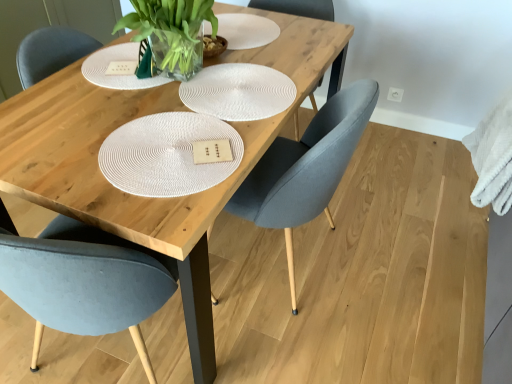
Question: Is matte gray chair at center, marked as the 2th chair in a right-to-left arrangement, aimed at matte gray chair at center, which is counted as the 1th chair, starting from the right?

Choices:
 (A) no
 (B) yes

Answer: (A)

Question: Does matte gray chair at center, marked as the 2th chair in a right-to-left arrangement, appear on the left side of matte gray chair at center, which is counted as the 1th chair, starting from the right?

Choices:
 (A) yes
 (B) no

Answer: (A)

Question: From a real-world perspective, is matte gray chair at center, marked as the 2th chair in a right-to-left arrangement, physically below matte gray chair at center, which appears as the 2th chair when viewed from the left?

Choices:
 (A) yes
 (B) no

Answer: (B)

Question: Can you confirm if matte gray chair at center, marked as the 2th chair in a right-to-left arrangement, is taller than matte gray chair at center, which appears as the 2th chair when viewed from the left?

Choices:
 (A) yes
 (B) no

Answer: (B)

Question: Are matte gray chair at center, marked as the 2th chair in a right-to-left arrangement, and matte gray chair at center, which appears as the 2th chair when viewed from the left, far apart?

Choices:
 (A) no
 (B) yes

Answer: (A)

Question: From the image's perspective, does matte gray chair at center, which ranks as the 1th chair in left-to-right order, appear lower than matte gray chair at center, which appears as the 2th chair when viewed from the left?

Choices:
 (A) yes
 (B) no

Answer: (A)

Question: Is matte gray chair at center, which ranks as the 1th chair in left-to-right order, placed right next to wooden table at center?

Choices:
 (A) yes
 (B) no

Answer: (B)

Question: Considering the relative sizes of matte gray chair at center, which ranks as the 1th chair in left-to-right order, and wooden table at center in the image provided, is matte gray chair at center, which ranks as the 1th chair in left-to-right order, thinner than wooden table at center?

Choices:
 (A) no
 (B) yes

Answer: (B)

Question: Considering the relative sizes of matte gray chair at center, which ranks as the 1th chair in left-to-right order, and wooden table at center in the image provided, is matte gray chair at center, which ranks as the 1th chair in left-to-right order, wider than wooden table at center?

Choices:
 (A) no
 (B) yes

Answer: (A)

Question: From a real-world perspective, does matte gray chair at center, marked as the 2th chair in a right-to-left arrangement, stand above wooden table at center?

Choices:
 (A) no
 (B) yes

Answer: (B)

Question: Considering the relative sizes of matte gray chair at center, which ranks as the 1th chair in left-to-right order, and wooden table at center in the image provided, is matte gray chair at center, which ranks as the 1th chair in left-to-right order, taller than wooden table at center?

Choices:
 (A) yes
 (B) no

Answer: (A)

Question: Is matte gray chair at center, marked as the 2th chair in a right-to-left arrangement, not close to wooden table at center?

Choices:
 (A) no
 (B) yes

Answer: (A)

Question: Is matte gray chair at center, which is counted as the 1th chair, starting from the right, completely or partially inside white fluffy towel at right?

Choices:
 (A) yes
 (B) no

Answer: (B)